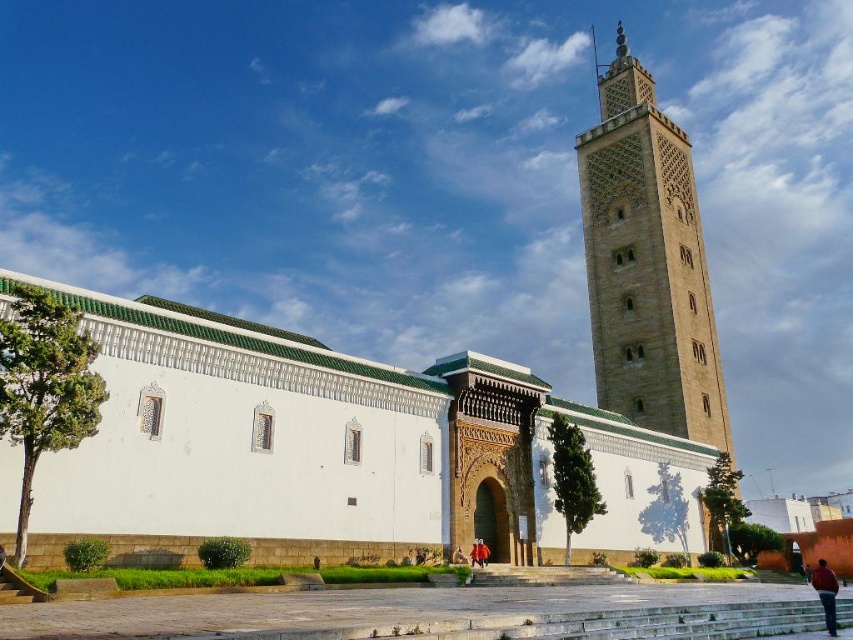
Which is more to the right, brown stone minaret at upper right or brown leather jacket at lower right?

From the viewer's perspective, brown stone minaret at upper right appears more on the right side.

Between brown stone minaret at upper right and brown leather jacket at lower right, which one appears on the left side from the viewer's perspective?

Positioned to the left is brown leather jacket at lower right.

Is point (672, 284) farther from viewer compared to point (825, 577)?

That is True.

Find the location of a particular element. brown stone minaret at upper right is located at coordinates (x=647, y=264).

From the picture: Is white textured wall at center shorter than brown leather jacket at lower right?

Incorrect, white textured wall at center's height does not fall short of brown leather jacket at lower right's.

Which is in front, point (125, 412) or point (827, 598)?

Point (827, 598) is more forward.

This screenshot has width=853, height=640. What do you see at coordinates (340, 444) in the screenshot? I see `white textured wall at center` at bounding box center [340, 444].

Where is `white textured wall at center`? The image size is (853, 640). white textured wall at center is located at coordinates (340, 444).

Can you confirm if white textured wall at center is bigger than brown stone minaret at upper right?

Incorrect, white textured wall at center is not larger than brown stone minaret at upper right.

Does white textured wall at center have a greater height compared to brown stone minaret at upper right?

No.

Who is more forward, (244, 324) or (677, 433)?

Point (244, 324) is in front.

Find the location of a particular element. Image resolution: width=853 pixels, height=640 pixels. white textured wall at center is located at coordinates (340, 444).